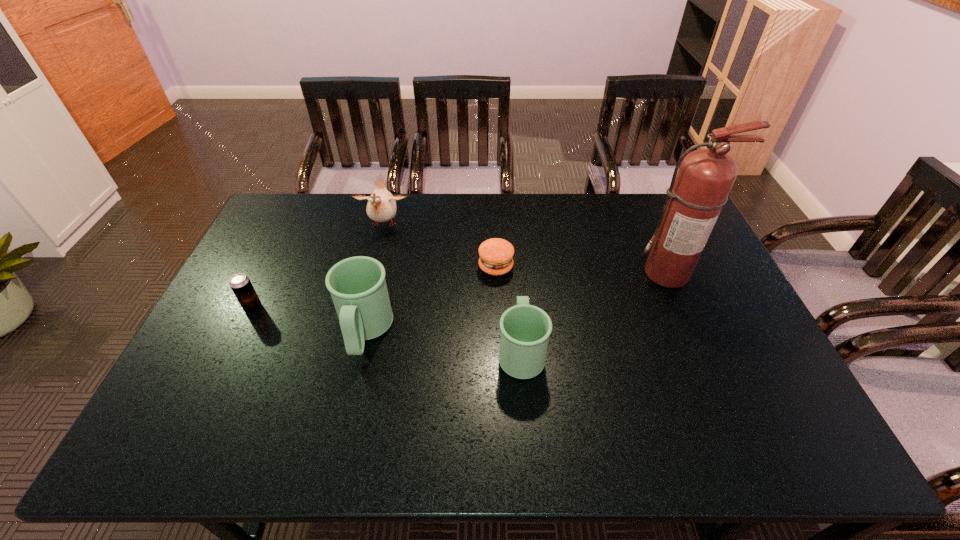
This screenshot has height=540, width=960. What are the coordinates of `free space for a new mug on the right` in the screenshot? It's located at (689, 373).